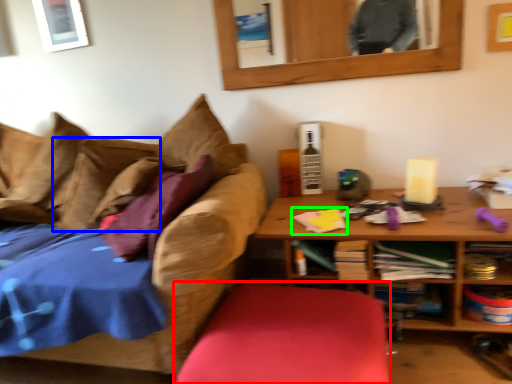
Question: Which object is the farthest from swivel chair (highlighted by a red box)? Choose among these: pillow (highlighted by a blue box) or book (highlighted by a green box).

Choices:
 (A) pillow
 (B) book

Answer: (A)